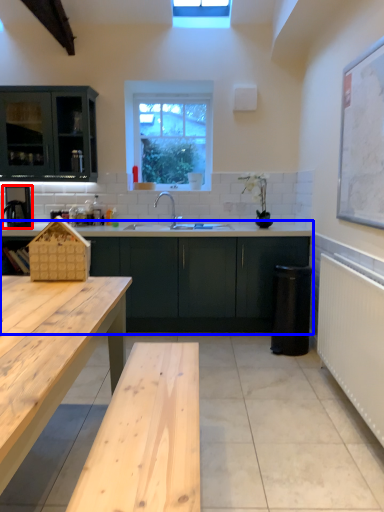
Question: Which point is further to the camera, appliance (highlighted by a red box) or cabinetry (highlighted by a blue box)?

Choices:
 (A) appliance
 (B) cabinetry

Answer: (A)